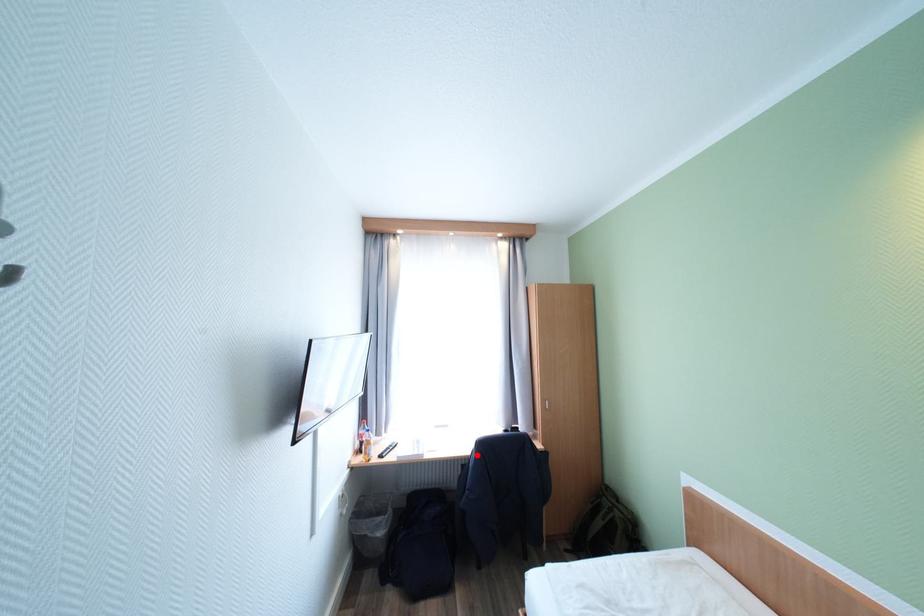
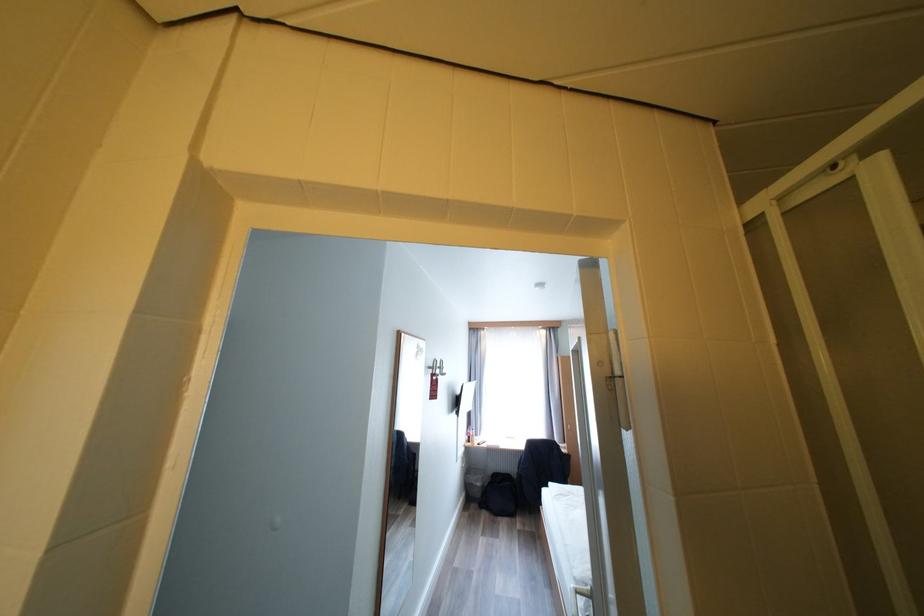
Question: I am providing you with two images of the same scene from different viewpoints. A red point is marked on the first image. Can you still see the location of the red point in image 2?

Choices:
 (A) Yes
 (B) No

Answer: (B)